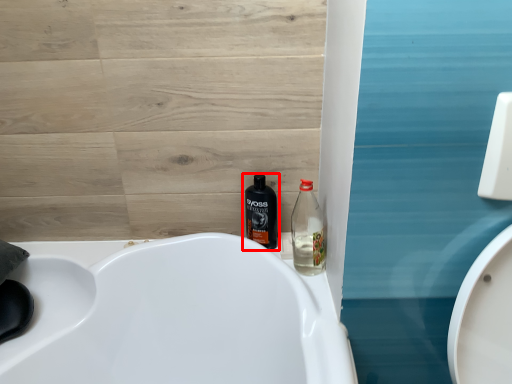
Question: Observing the image, what is the correct spatial positioning of bottle (annotated by the red box) in reference to bottle?

Choices:
 (A) left
 (B) right

Answer: (A)